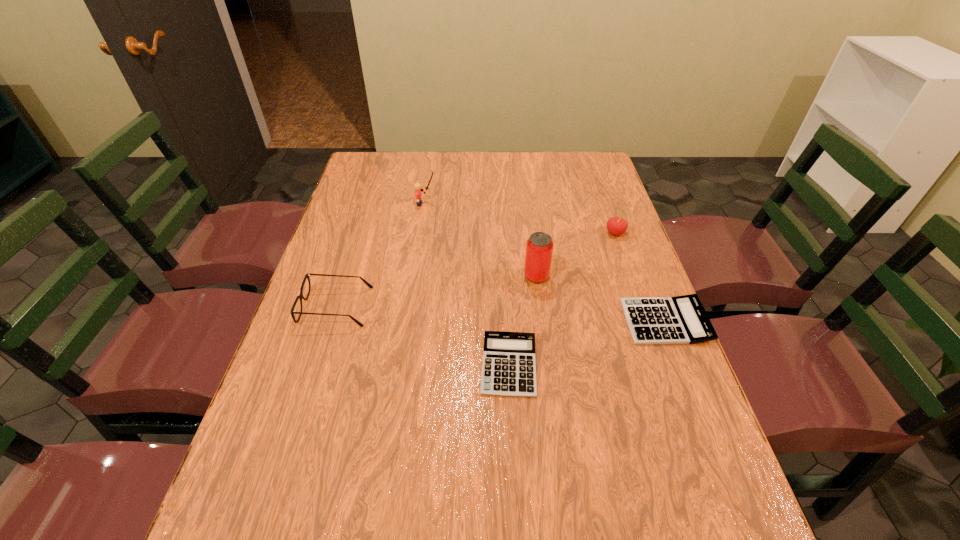
At what (x,y) coordinates should I click in order to perform the action: click on vacant space that's between the shorter calculator and the tallest object. Please return your answer as a coordinate pair (x, y). The width and height of the screenshot is (960, 540). Looking at the image, I should click on (522, 321).

This screenshot has height=540, width=960. I want to click on blank region between the Lego and the left calculator, so click(x=468, y=285).

Identify the location of vacant area between the fifth object from right to left and the left calculator. The width and height of the screenshot is (960, 540). (468, 285).

What are the coordinates of `blank region between the Lego and the shorter calculator` in the screenshot? It's located at (468, 285).

At what (x,y) coordinates should I click in order to perform the action: click on unoccupied area between the taller calculator and the fifth nearest object. Please return your answer as a coordinate pair (x, y). Looking at the image, I should click on (640, 277).

What are the coordinates of `free area in between the spectacles and the shorter calculator` in the screenshot? It's located at (422, 336).

Find the location of a particular element. The width and height of the screenshot is (960, 540). object that stands as the fourth closest to the taller calculator is located at coordinates (307, 275).

Select which object is the second closest to the cherry. Please provide its 2D coordinates. Your answer should be formatted as a tuple, i.e. [(x, y)], where the tuple contains the x and y coordinates of a point satisfying the conditions above.

[(682, 319)]

At what (x,y) coordinates should I click in order to perform the action: click on vacant space that satisfies the following two spatial constraints: 1. on the front side of the tallest object; 2. on the left side of the second shortest object. Please return your answer as a coordinate pair (x, y). The image size is (960, 540). Looking at the image, I should click on (542, 322).

Image resolution: width=960 pixels, height=540 pixels. I want to click on vacant point that satisfies the following two spatial constraints: 1. on the back side of the fifth tallest object; 2. with the lenses facing outward on the spectacles, so click(660, 307).